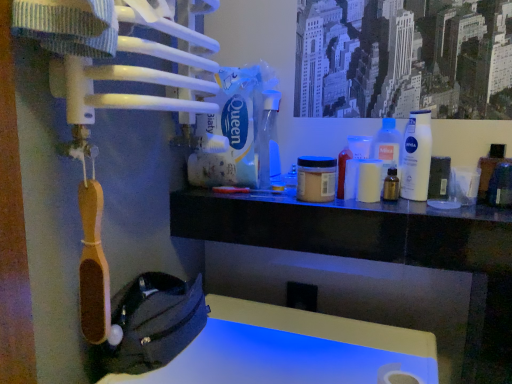
Identify the location of free point in front of white plastic bottle at upper right, which appears as the third bottle when viewed from the left. The image size is (512, 384). (438, 209).